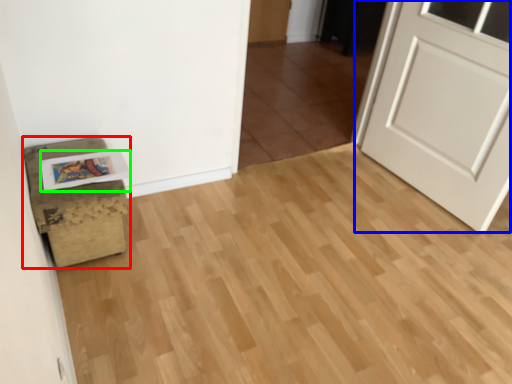
Question: Estimate the real-world distances between objects in this image. Which object is closer to furniture (highlighted by a red box), door (highlighted by a blue box) or postcard (highlighted by a green box)?

Choices:
 (A) door
 (B) postcard

Answer: (B)